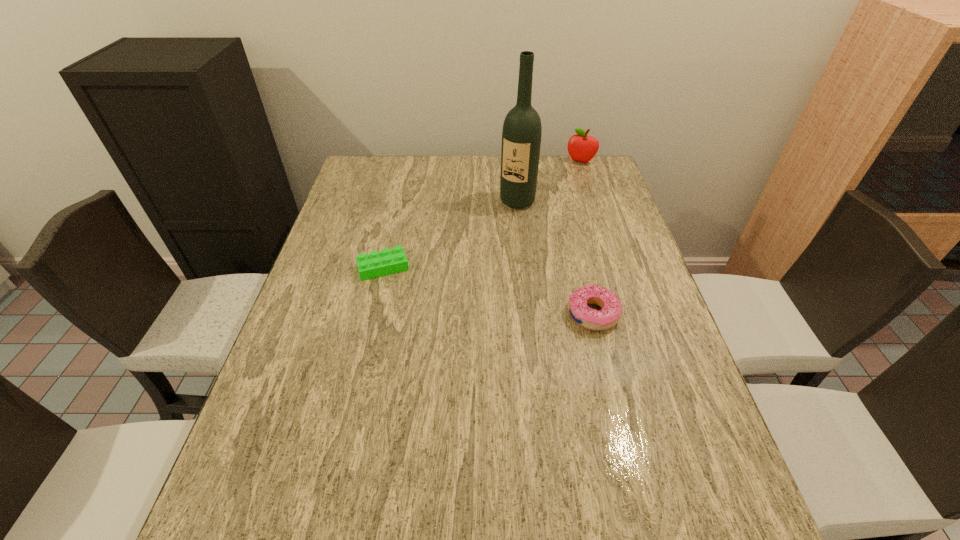
At what (x,y) coordinates should I click in order to perform the action: click on vacant space that satisfies the following two spatial constraints: 1. on the back side of the second nearest object; 2. on the right side of the third shortest object. Please return your answer as a coordinate pair (x, y). Image resolution: width=960 pixels, height=540 pixels. Looking at the image, I should click on (408, 162).